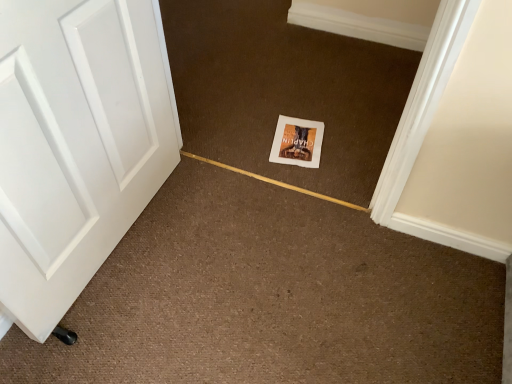
Identify the location of free region under white paper postcard at center (from a real-world perspective). Image resolution: width=512 pixels, height=384 pixels. (301, 141).